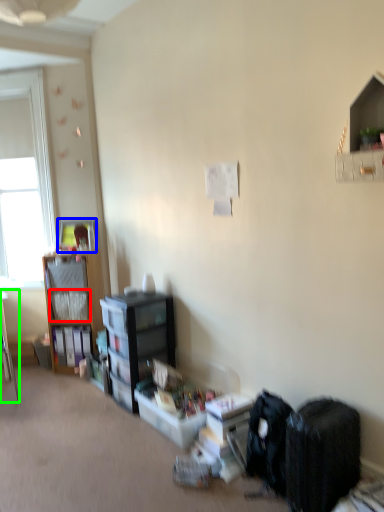
Question: Estimate the real-world distances between objects in this image. Which object is farther from shelf (highlighted by a red box), picture frame (highlighted by a blue box) or desk (highlighted by a green box)?

Choices:
 (A) picture frame
 (B) desk

Answer: (B)